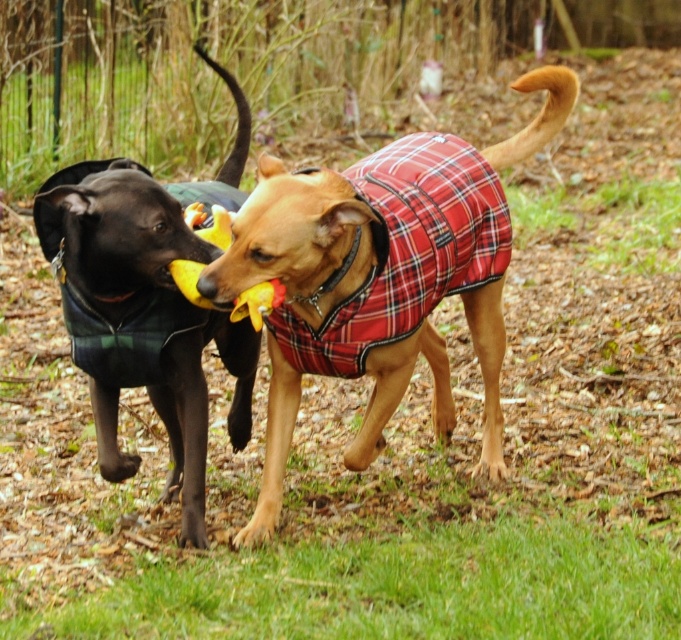
Based on the photo, you are a photographer trying to capture both the shiny black coat at left and the yellow rubber duck at center in a single frame. Which object should you focus on first to ensure both are in the frame?

The shiny black coat at left is wider than the yellow rubber duck at center, so you should focus on the shiny black coat at left first to ensure both fit in the frame.

You are a dog owner trying to decide whether to place a small toy between the shiny black coat at left and the plaid fabric dog coat at center. The toy requires at least 70 centimeters of space to fit. Based on the image, can the toy be placed there?

The shiny black coat at left and plaid fabric dog coat at center are 68.17 centimeters apart. Since the required space is 70 centimeters, the toy cannot be placed between them as there is insufficient space.

You are a dog owner who wants to retrieve the yellow rubber duck at center for your dog. The plaid fabric dog coat at center is in the way. Can you move the coat to get the duck? Please state the distance between them in your answer.

The plaid fabric dog coat at center and yellow rubber duck at center are 21.08 inches apart. Since the coat is blocking the path, you can move it to access the duck.